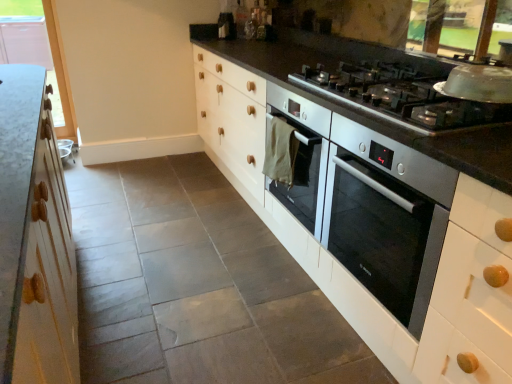
Question: Is satin silver gas stove at upper right in front of or behind clear glass window at upper left in the image?

Choices:
 (A) front
 (B) behind

Answer: (A)

Question: Is satin silver gas stove at upper right situated inside clear glass window at upper left or outside?

Choices:
 (A) outside
 (B) inside

Answer: (A)

Question: Which is nearer to the clear glass window at upper left?

Choices:
 (A) satin silver oven at center-right
 (B) satin silver gas stove at upper right

Answer: (B)

Question: Which is farther from the satin silver oven at center-right?

Choices:
 (A) clear glass window at upper left
 (B) satin silver gas stove at upper right

Answer: (A)